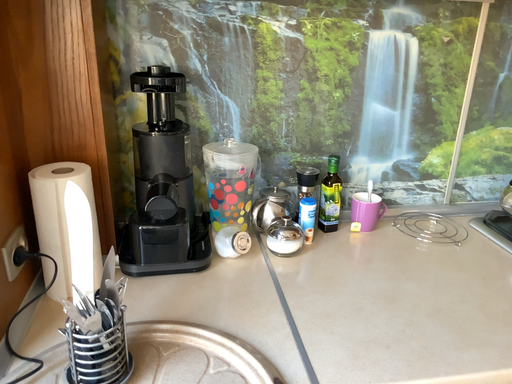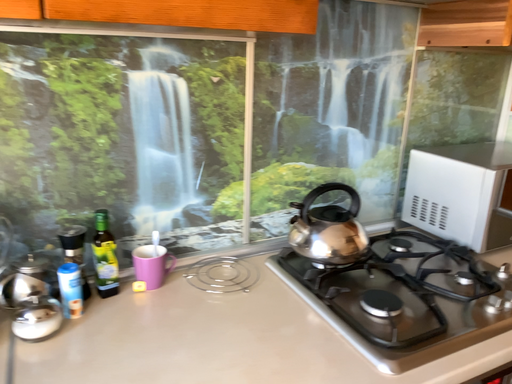
Question: Which way did the camera rotate in the video?

Choices:
 (A) rotated left
 (B) rotated right

Answer: (B)